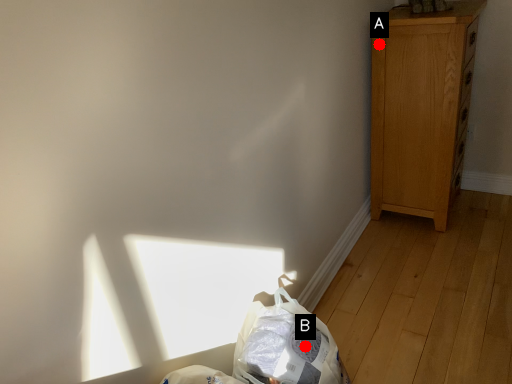
Question: Two points are circled on the image, labeled by A and B beside each circle. Which point is farther to the camera?

Choices:
 (A) A is further
 (B) B is further

Answer: (A)